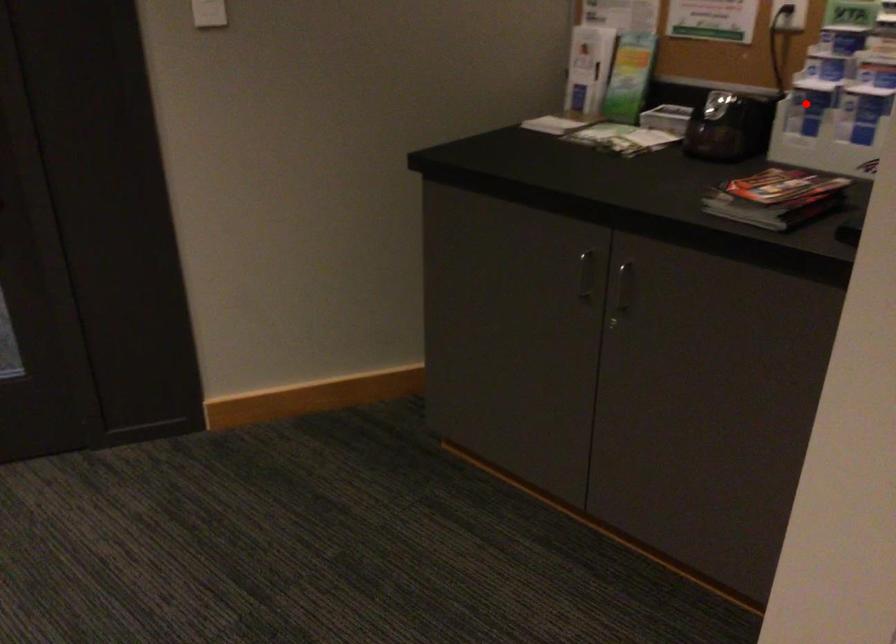
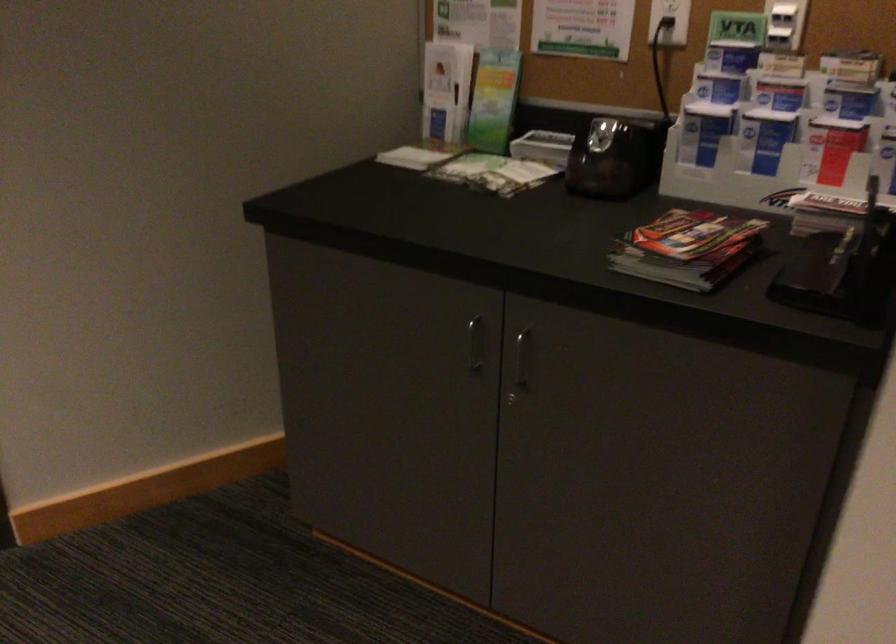
Question: I am providing you with two images of the same scene from different viewpoints. Image1 has a red point marked. In image2, the corresponding 3D location appears at what relative position? Reply with the corresponding letter.

Choices:
 (A) Closer
 (B) Farther

Answer: (A)